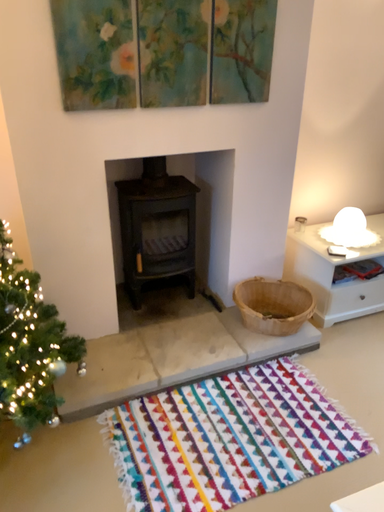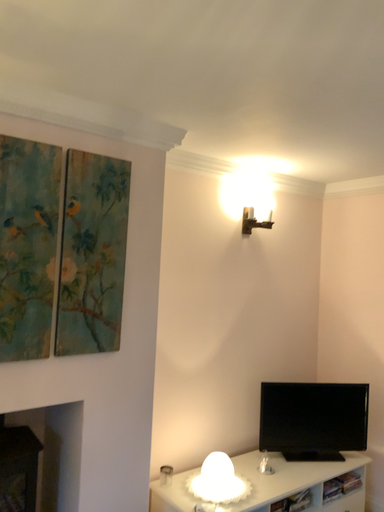
Question: How did the camera likely rotate when shooting the video?

Choices:
 (A) rotated left
 (B) rotated right

Answer: (B)